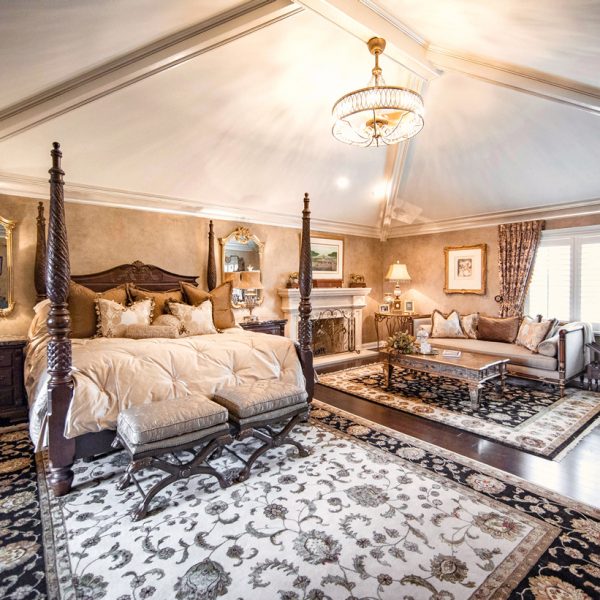
You are a GUI agent. You are given a task and a screenshot of the screen. Output one action in this format:
    pyautogui.click(x=<x>, y=<y>)
    Task: Click on the bedroom
    
    Given the screenshot: What is the action you would take?
    471,366